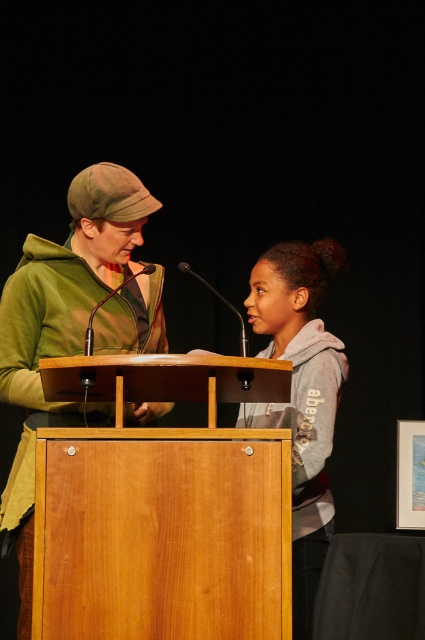
Question: Is green matte jacket at center closer to the viewer compared to gray fleece hoodie at center?

Choices:
 (A) no
 (B) yes

Answer: (B)

Question: Which of the following is the farthest from the observer?

Choices:
 (A) (311, 308)
 (B) (266, 573)

Answer: (A)

Question: Does green matte jacket at center have a larger size compared to gray fleece hoodie at center?

Choices:
 (A) no
 (B) yes

Answer: (B)

Question: Is wooden podium at center closer to camera compared to green matte jacket at center?

Choices:
 (A) no
 (B) yes

Answer: (B)

Question: Estimate the real-world distances between objects in this image. Which object is farther from the gray fleece hoodie at center?

Choices:
 (A) green matte jacket at center
 (B) wooden podium at center

Answer: (A)

Question: Considering the real-world distances, which object is closest to the green matte jacket at center?

Choices:
 (A) gray fleece hoodie at center
 (B) wooden podium at center

Answer: (B)